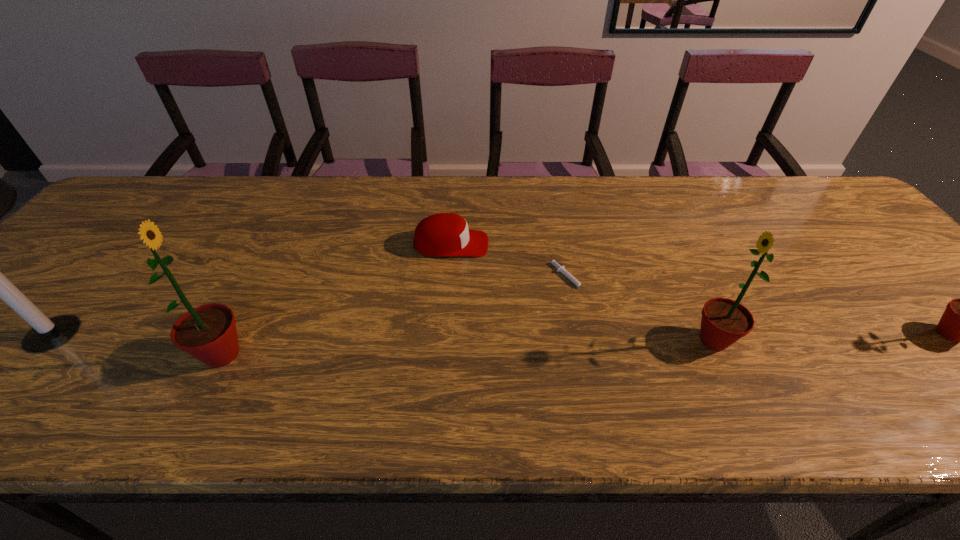
You are a GUI agent. You are given a task and a screenshot of the screen. Output one action in this format:
    pyautogui.click(x=<x>, y=<y>)
    Task: Click on the vacant space located 0.390m on the face of the second tallest sunflower
    This screenshot has width=960, height=540.
    Given the screenshot: What is the action you would take?
    pyautogui.click(x=511, y=340)

You are a GUI agent. You are given a task and a screenshot of the screen. Output one action in this format:
    pyautogui.click(x=<x>, y=<y>)
    Task: Click on the blank area located 0.140m on the front-facing side of the second shortest object
    This screenshot has height=540, width=960.
    Given the screenshot: What is the action you would take?
    pyautogui.click(x=540, y=244)

At what (x,y) coordinates should I click in order to perform the action: click on free location located 0.060m on the front of the syringe. Please return your answer as a coordinate pair (x, y). The width and height of the screenshot is (960, 540). Looking at the image, I should click on (577, 316).

This screenshot has width=960, height=540. Find the location of `vacant position at the far edge of the desktop`. vacant position at the far edge of the desktop is located at coordinates (370, 199).

You are a GUI agent. You are given a task and a screenshot of the screen. Output one action in this format:
    pyautogui.click(x=<x>, y=<y>)
    Task: Click on the free space at the near edge
    The width and height of the screenshot is (960, 540).
    Given the screenshot: What is the action you would take?
    pyautogui.click(x=421, y=351)

This screenshot has width=960, height=540. In the image, there is a desktop. What are the coordinates of `vacant space at the left edge` in the screenshot? It's located at (116, 246).

You are a GUI agent. You are given a task and a screenshot of the screen. Output one action in this format:
    pyautogui.click(x=<x>, y=<y>)
    Task: Click on the vacant space at the right edge
    This screenshot has width=960, height=540.
    Given the screenshot: What is the action you would take?
    pyautogui.click(x=858, y=232)

Find the location of a particular element. free location at the far right corner of the desktop is located at coordinates (828, 213).

Identify the location of vacant space in between the second shortest sunflower and the syringe. (641, 310).

This screenshot has width=960, height=540. Find the location of `vacant area that lies between the fourth object from right to left and the fourth object from left to right`. vacant area that lies between the fourth object from right to left and the fourth object from left to right is located at coordinates (510, 262).